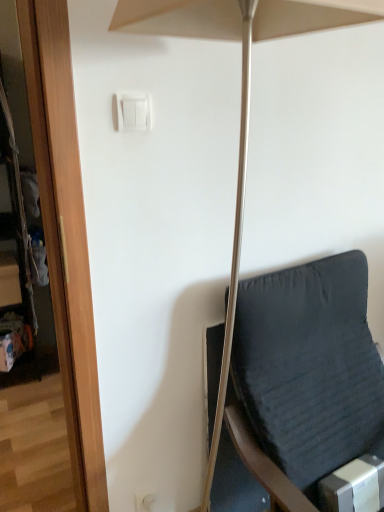
Question: From a real-world perspective, is white plastic light switch at upper center over dark fabric chair at right?

Choices:
 (A) no
 (B) yes

Answer: (B)

Question: From the image's perspective, is white plastic light switch at upper center under dark fabric chair at right?

Choices:
 (A) yes
 (B) no

Answer: (B)

Question: Would you say white plastic light switch at upper center is a long distance from dark fabric chair at right?

Choices:
 (A) no
 (B) yes

Answer: (A)

Question: From a real-world perspective, is white plastic light switch at upper center physically below dark fabric chair at right?

Choices:
 (A) yes
 (B) no

Answer: (B)

Question: Considering the relative positions of white plastic light switch at upper center and dark fabric chair at right in the image provided, is white plastic light switch at upper center behind dark fabric chair at right?

Choices:
 (A) no
 (B) yes

Answer: (B)

Question: Is dark fabric chair at right to the left or to the right of matte beige umbrella at center in the image?

Choices:
 (A) left
 (B) right

Answer: (B)

Question: Is dark fabric chair at right wider or thinner than matte beige umbrella at center?

Choices:
 (A) thin
 (B) wide

Answer: (B)

Question: Is dark fabric chair at right in front of or behind matte beige umbrella at center in the image?

Choices:
 (A) behind
 (B) front

Answer: (A)

Question: Does point (220, 350) appear closer or farther from the camera than point (322, 23)?

Choices:
 (A) closer
 (B) farther

Answer: (B)

Question: Is point (x=294, y=3) closer or farther from the camera than point (x=147, y=106)?

Choices:
 (A) farther
 (B) closer

Answer: (B)

Question: From the image's perspective, is matte beige umbrella at center above or below white plastic light switch at upper center?

Choices:
 (A) above
 (B) below

Answer: (B)

Question: Which is correct: matte beige umbrella at center is inside white plastic light switch at upper center, or outside of it?

Choices:
 (A) outside
 (B) inside

Answer: (A)

Question: Based on their sizes in the image, would you say matte beige umbrella at center is bigger or smaller than white plastic light switch at upper center?

Choices:
 (A) small
 (B) big

Answer: (B)

Question: From a real-world perspective, is white plastic light switch at upper center above or below matte beige umbrella at center?

Choices:
 (A) above
 (B) below

Answer: (A)

Question: Is white plastic light switch at upper center inside the boundaries of matte beige umbrella at center, or outside?

Choices:
 (A) outside
 (B) inside

Answer: (A)